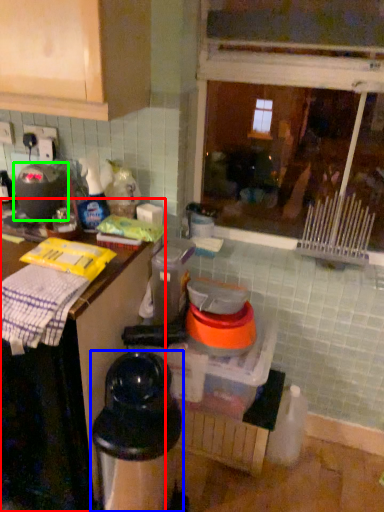
Question: Which object is the closest to the countertop (highlighted by a red box)? Choose among these: appliance (highlighted by a blue box) or appliance (highlighted by a green box).

Choices:
 (A) appliance
 (B) appliance

Answer: (A)